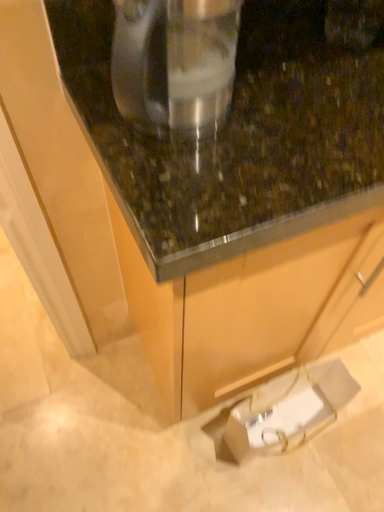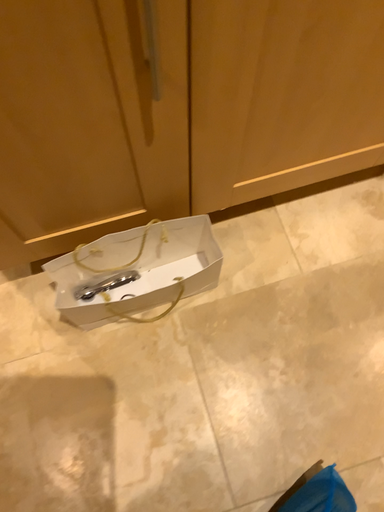
Question: Which way did the camera rotate in the video?

Choices:
 (A) rotated downward
 (B) rotated upward

Answer: (A)